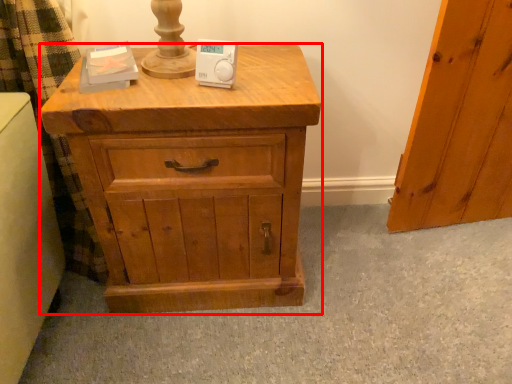
Question: From the image's perspective, considering the relative positions of chest of drawers (annotated by the red box) and ipod in the image provided, where is chest of drawers (annotated by the red box) located with respect to the staircase?

Choices:
 (A) below
 (B) above

Answer: (A)